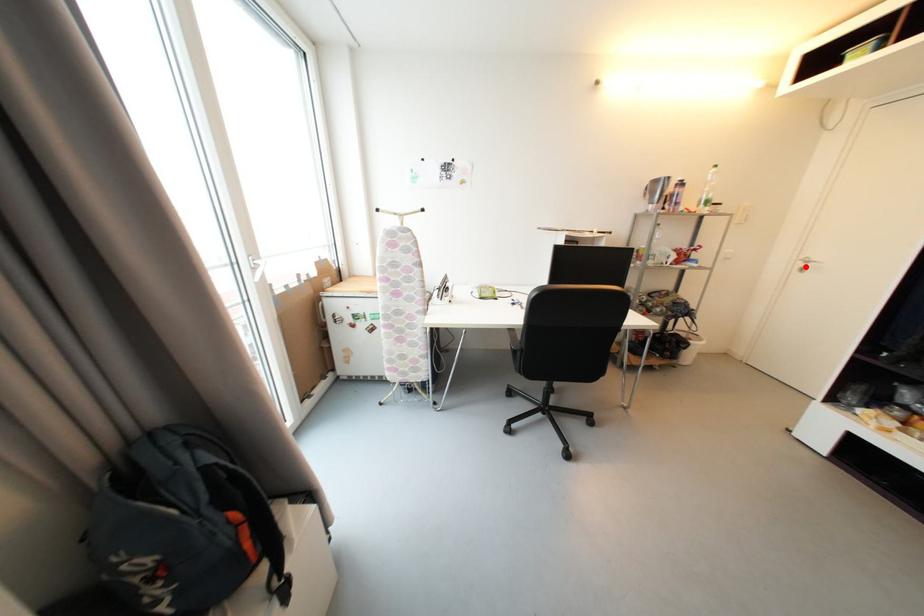
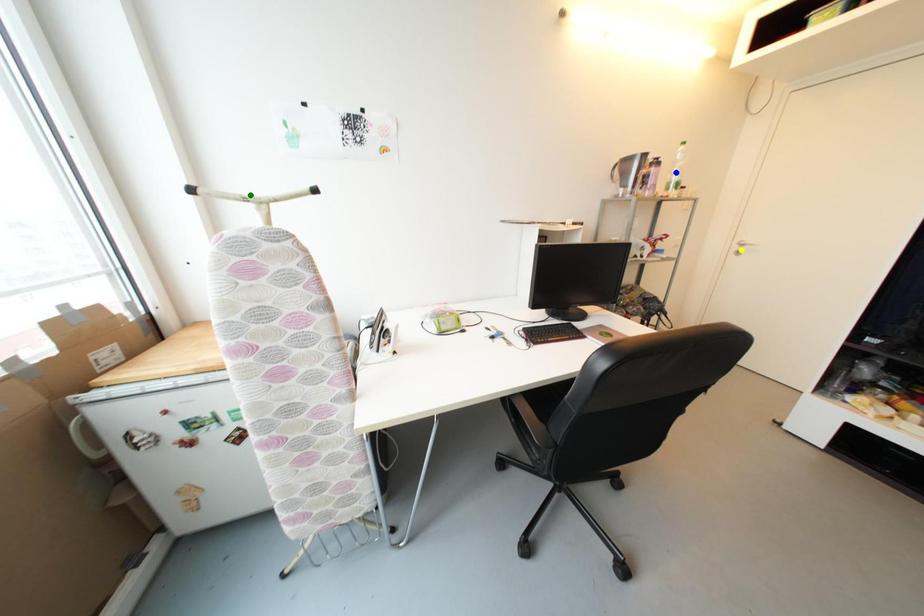
Question: I am providing you with two images of the same scene from different viewpoints. A red point is marked on the first image. You are given multiple points on the second image. Which spot in image 2 lines up with the point in image 1?

Choices:
 (A) green point
 (B) blue point
 (C) yellow point

Answer: (C)